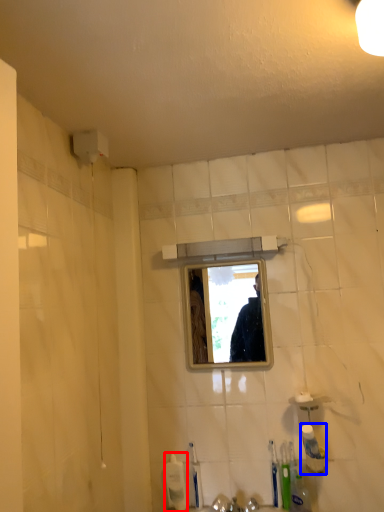
Question: Which object appears closest to the camera in this image, toiletry (highlighted by a red box) or toiletry (highlighted by a blue box)?

Choices:
 (A) toiletry
 (B) toiletry

Answer: (B)